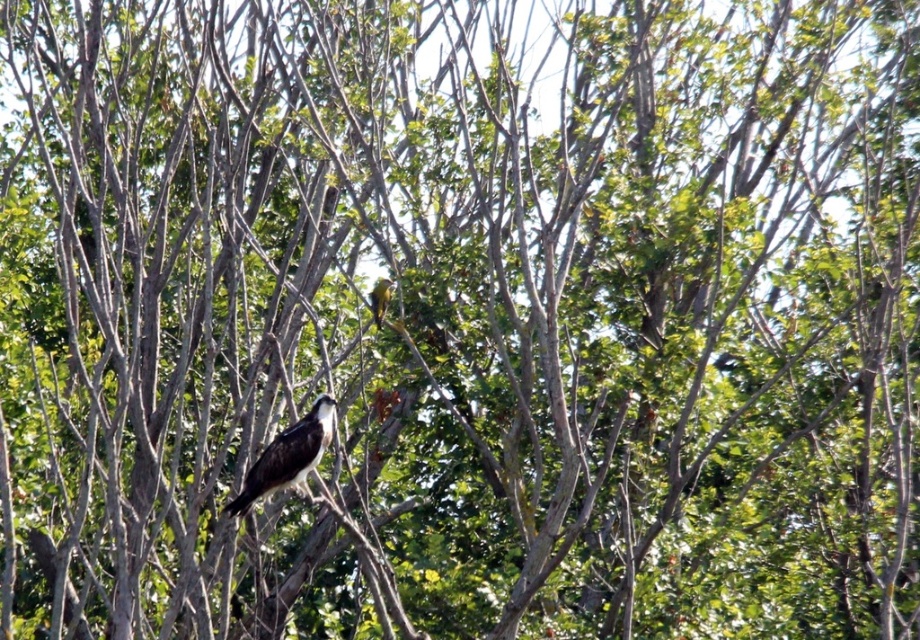
Question: Can you confirm if brown feathered bird at center is positioned to the left of golden yellow parrot at upper center?

Choices:
 (A) yes
 (B) no

Answer: (A)

Question: Which of the following is the farthest from the observer?

Choices:
 (A) (261, 493)
 (B) (388, 296)

Answer: (B)

Question: Which point is farther to the camera?

Choices:
 (A) (376, 307)
 (B) (282, 472)

Answer: (A)

Question: From the image, what is the correct spatial relationship of brown feathered bird at center in relation to golden yellow parrot at upper center?

Choices:
 (A) above
 (B) below

Answer: (B)

Question: Can you confirm if brown feathered bird at center is wider than golden yellow parrot at upper center?

Choices:
 (A) no
 (B) yes

Answer: (B)